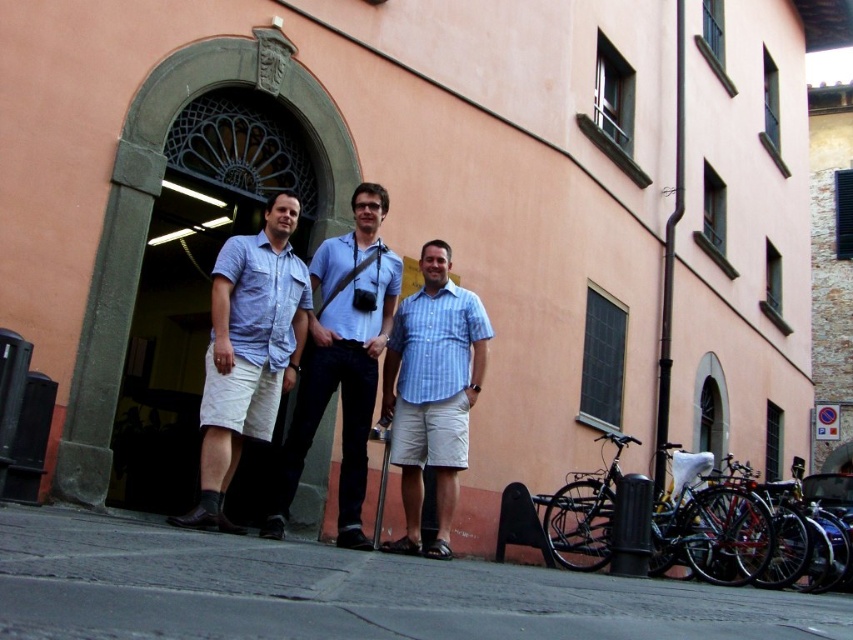
Can you confirm if gray concrete pavement at lower center is positioned above blue striped shirt at center?

No.

Is gray concrete pavement at lower center further to the viewer compared to blue striped shirt at center?

That is False.

Is point (32, 525) closer to viewer compared to point (403, 381)?

Yes.

This screenshot has width=853, height=640. Find the location of `gray concrete pavement at lower center`. gray concrete pavement at lower center is located at coordinates (347, 593).

Does light blue shirt at center have a lesser width compared to blue striped shirt at center?

No.

Between point (361, 241) and point (460, 428), which one is positioned in front?

Point (460, 428) is more forward.

What do you see at coordinates (341, 362) in the screenshot? I see `light blue shirt at center` at bounding box center [341, 362].

Where is `light blue shirt at center`? This screenshot has height=640, width=853. light blue shirt at center is located at coordinates (341, 362).

Can you confirm if gray concrete pavement at lower center is positioned to the right of blue denim shirt at center?

Indeed, gray concrete pavement at lower center is positioned on the right side of blue denim shirt at center.

Is gray concrete pavement at lower center further to camera compared to blue denim shirt at center?

That is False.

This screenshot has width=853, height=640. What do you see at coordinates (347, 593) in the screenshot? I see `gray concrete pavement at lower center` at bounding box center [347, 593].

Where is `gray concrete pavement at lower center`? The width and height of the screenshot is (853, 640). gray concrete pavement at lower center is located at coordinates (347, 593).